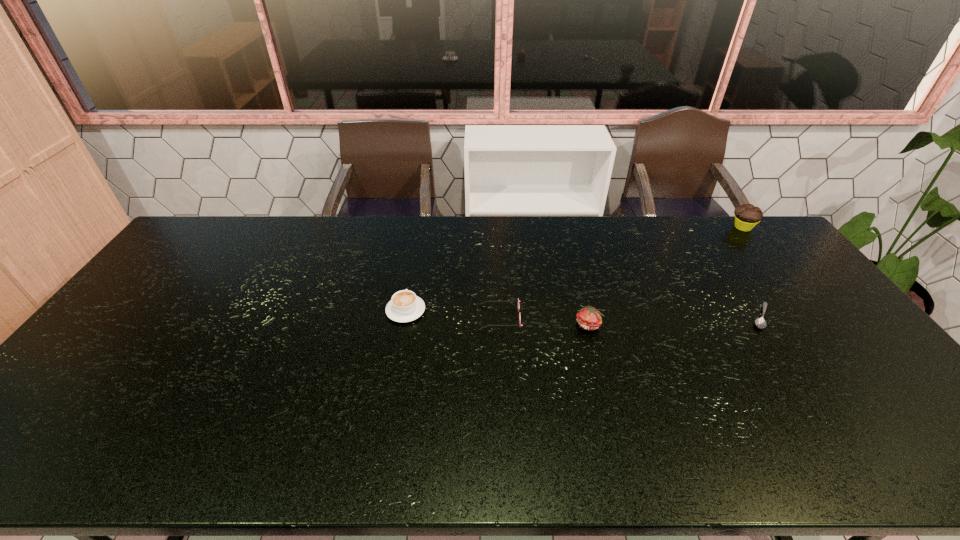
Find the location of `free space between the third object from right to left and the cappuccino`. free space between the third object from right to left and the cappuccino is located at coordinates (497, 318).

Locate an element on the screen. The width and height of the screenshot is (960, 540). unoccupied area between the second object from left to right and the fourth shortest object is located at coordinates (544, 321).

You are a GUI agent. You are given a task and a screenshot of the screen. Output one action in this format:
    pyautogui.click(x=<x>, y=<y>)
    Task: Click on the free space between the farthest object and the second shortest object
    This screenshot has width=960, height=540.
    Given the screenshot: What is the action you would take?
    coord(621,273)

The height and width of the screenshot is (540, 960). In order to click on unoccupied area between the leftmost object and the fourth object from right to left in this screenshot , I will do `click(453, 314)`.

Identify which object is the closest to the third shortest object. Please provide its 2D coordinates. Your answer should be formatted as a tuple, i.e. [(x, y)], where the tuple contains the x and y coordinates of a point satisfying the conditions above.

[(518, 300)]

Select which object appears as the second closest to the rightmost object. Please provide its 2D coordinates. Your answer should be formatted as a tuple, i.e. [(x, y)], where the tuple contains the x and y coordinates of a point satisfying the conditions above.

[(589, 318)]

At what (x,y) coordinates should I click in order to perform the action: click on vacant space that satisfies the following two spatial constraints: 1. on the front side of the second object from right to left; 2. on the bridge of the second object from left to right. Please return your answer as a coordinate pair (x, y). Looking at the image, I should click on (762, 318).

Where is `free location that satisfies the following two spatial constraints: 1. on the bridge of the second tallest object; 2. on the right side of the fourth object from right to left`? The height and width of the screenshot is (540, 960). free location that satisfies the following two spatial constraints: 1. on the bridge of the second tallest object; 2. on the right side of the fourth object from right to left is located at coordinates (500, 325).

Identify the location of vacant space that satisfies the following two spatial constraints: 1. on the side of the third shortest object with the handle; 2. on the left side of the tallest object. (420, 227).

This screenshot has height=540, width=960. Identify the location of vacant space that satisfies the following two spatial constraints: 1. on the back side of the tomato; 2. on the left side of the farthest object. (564, 227).